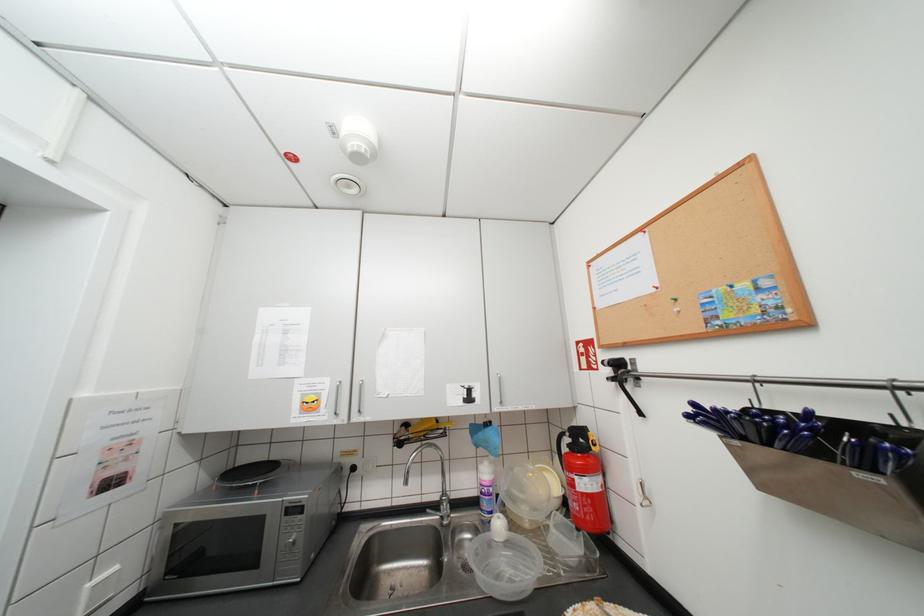
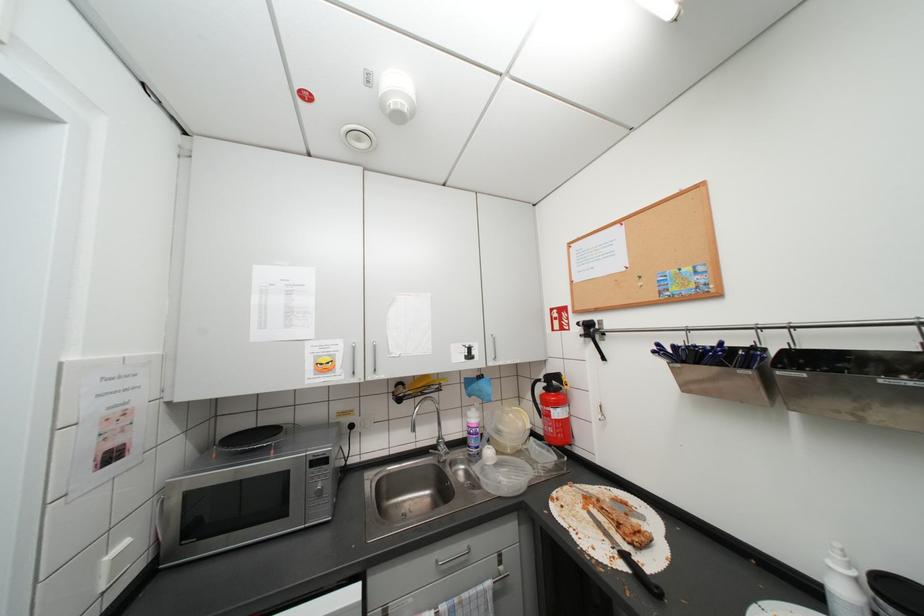
Question: The images are taken continuously from a first-person perspective. In which direction is your viewpoint rotating?

Choices:
 (A) Left
 (B) Right
 (C) Up
 (D) Down

Answer: (B)